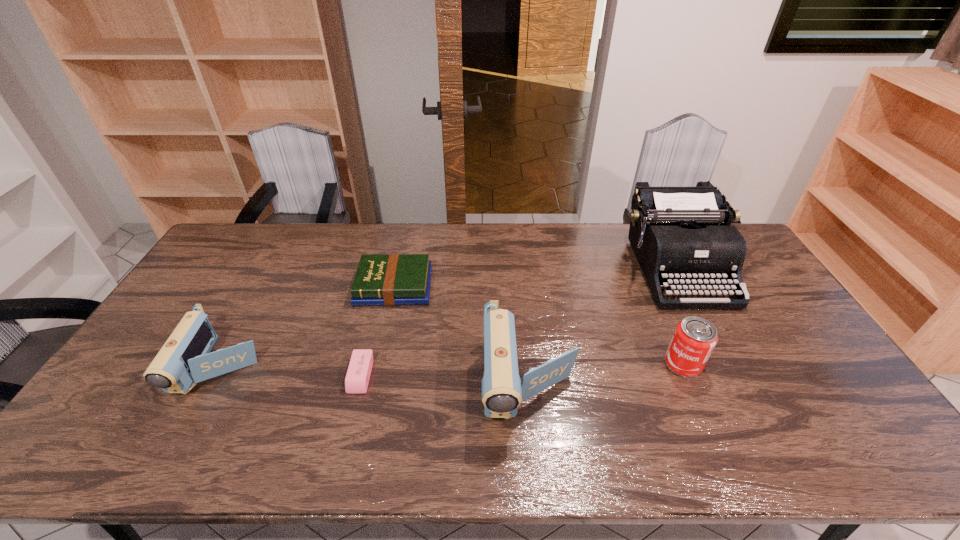
Locate an element on the screen. the leftmost object is located at coordinates (185, 359).

The width and height of the screenshot is (960, 540). In order to click on the left camcorder in this screenshot , I will do (185, 359).

Locate an element on the screen. The image size is (960, 540). the second tallest object is located at coordinates (502, 390).

Find the location of `the third object from right to left`. the third object from right to left is located at coordinates (502, 390).

The width and height of the screenshot is (960, 540). What are the coordinates of `the tallest object` in the screenshot? It's located at (674, 232).

You are a GUI agent. You are given a task and a screenshot of the screen. Output one action in this format:
    pyautogui.click(x=<x>, y=<y>)
    Task: Click on the shortest object
    The width and height of the screenshot is (960, 540).
    Given the screenshot: What is the action you would take?
    pyautogui.click(x=358, y=374)

I want to click on book, so click(x=396, y=279).

Locate an element on the screen. The height and width of the screenshot is (540, 960). can is located at coordinates (694, 339).

Locate an element on the screen. Image resolution: width=960 pixels, height=540 pixels. vacant space located 0.060m on the typing side of the tallest object is located at coordinates click(706, 326).

You are a GUI agent. You are given a task and a screenshot of the screen. Output one action in this format:
    pyautogui.click(x=<x>, y=<y>)
    Task: Click on the vacant space situated 0.190m on the right of the shortest object
    
    Given the screenshot: What is the action you would take?
    pyautogui.click(x=442, y=375)